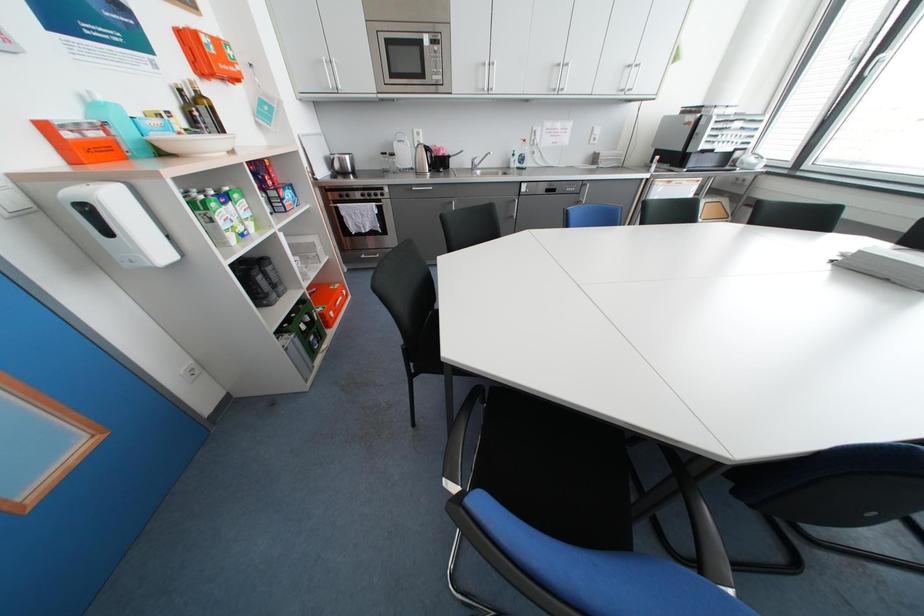
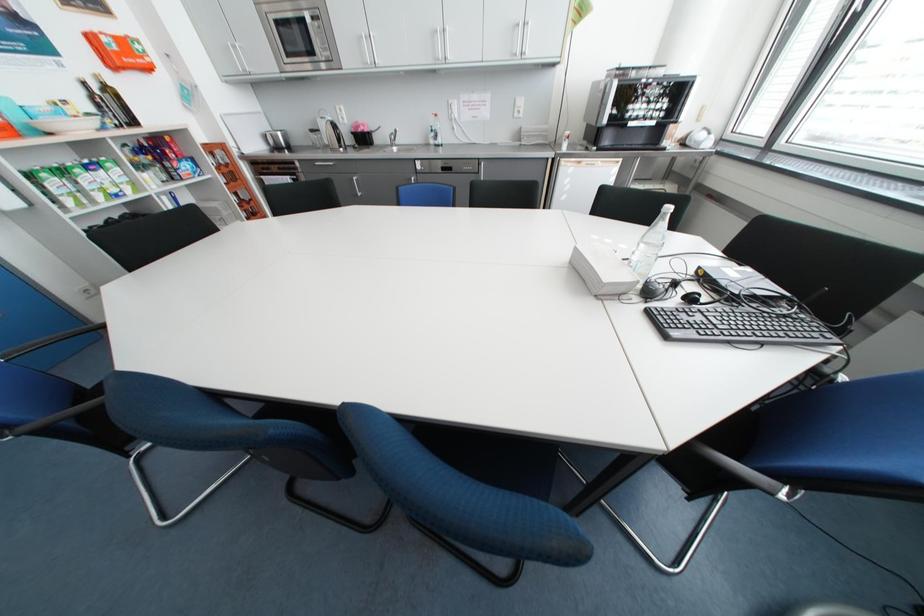
Question: In a continuous first-person perspective shot, in which direction is the camera moving?

Choices:
 (A) Left
 (B) Right
 (C) Forward
 (D) Backward

Answer: (B)